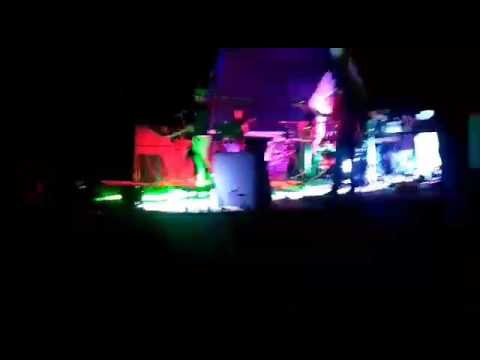
Where is `magenta light`? The height and width of the screenshot is (360, 480). magenta light is located at coordinates (323, 92), (284, 151).